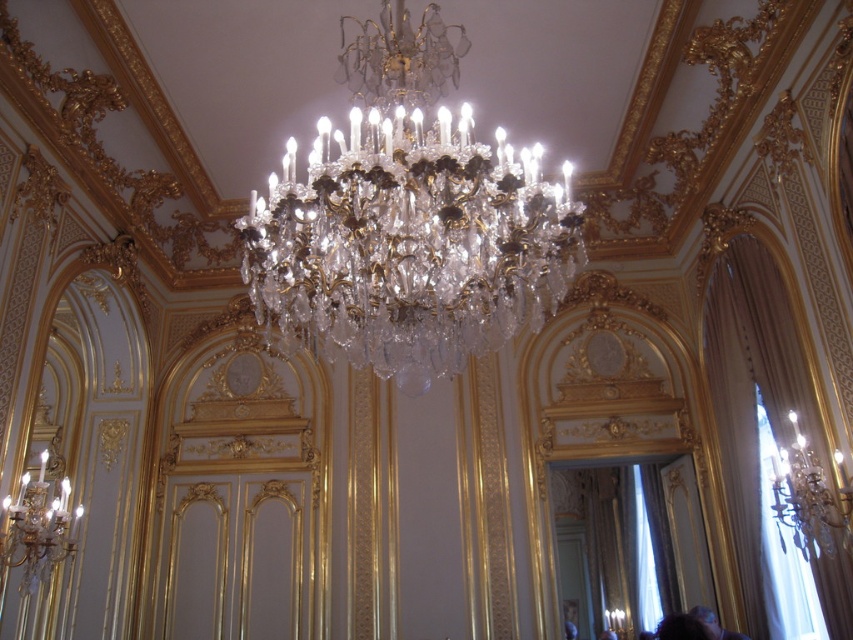
Consider the image. Measure the distance between point (277,314) and camera.

Point (277,314) is 6.59 meters from camera.

Find the location of a particular element. The image size is (853, 640). crystal/golden chandelier at center is located at coordinates (408, 220).

Is point (363, 323) positioned in front of point (689, 611)?

Yes, it is.

Identify the location of crystal/golden chandelier at center. The height and width of the screenshot is (640, 853). (408, 220).

Describe the element at coordinates (408, 220) in the screenshot. I see `crystal/golden chandelier at center` at that location.

Find the location of a particular element. This screenshot has height=640, width=853. crystal/golden chandelier at center is located at coordinates (408, 220).

Is point (434, 232) in front of point (799, 532)?

Yes.

This screenshot has height=640, width=853. What are the coordinates of `crystal/golden chandelier at center` in the screenshot? It's located at (408, 220).

Which is above, clear crystal chandelier at upper center or smooth skin face at lower right?

Positioned higher is clear crystal chandelier at upper center.

Is clear crystal chandelier at upper center wider than smooth skin face at lower right?

Incorrect, clear crystal chandelier at upper center's width does not surpass smooth skin face at lower right's.

Is point (798, 516) farther from viewer compared to point (703, 621)?

No, (798, 516) is in front of (703, 621).

The image size is (853, 640). What are the coordinates of `clear crystal chandelier at upper center` in the screenshot? It's located at (809, 497).